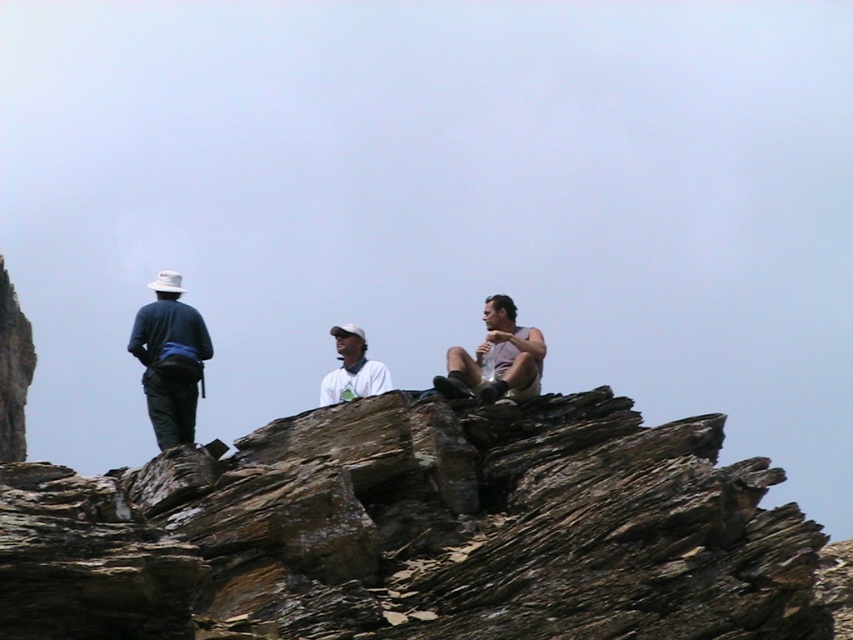
Can you confirm if matte gray tank top at center is positioned to the left of white matte shirt at center?

Incorrect, matte gray tank top at center is not on the left side of white matte shirt at center.

Can you confirm if matte gray tank top at center is smaller than white matte shirt at center?

Indeed, matte gray tank top at center has a smaller size compared to white matte shirt at center.

Is point (512, 392) positioned behind point (323, 388)?

That is False.

Where is `matte gray tank top at center`? The width and height of the screenshot is (853, 640). matte gray tank top at center is located at coordinates (496, 356).

Is matte blue shirt at left behind white matte shirt at center?

No, matte blue shirt at left is in front of white matte shirt at center.

Who is lower down, matte blue shirt at left or white matte shirt at center?

white matte shirt at center

Is point (136, 320) positioned in front of point (341, 340)?

Yes, point (136, 320) is closer to viewer.

At what (x,y) coordinates should I click in order to perform the action: click on matte blue shirt at left. Please return your answer as a coordinate pair (x, y). Looking at the image, I should click on (170, 358).

Is matte blue shirt at left behind matte gray tank top at center?

No, it is not.

Can you confirm if matte blue shirt at left is bigger than matte gray tank top at center?

Indeed, matte blue shirt at left has a larger size compared to matte gray tank top at center.

Find the location of `matte blue shirt at left`. matte blue shirt at left is located at coordinates (170, 358).